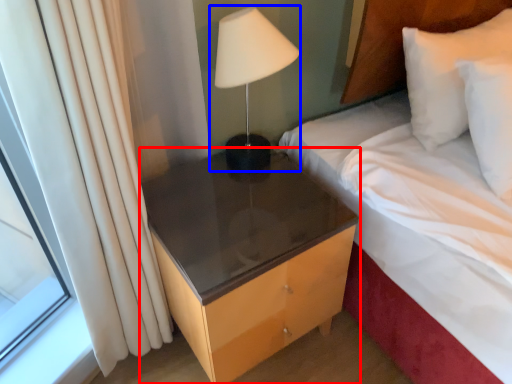
Question: Which of the following is the closest to the observer, nightstand (highlighted by a red box) or bedside lamp (highlighted by a blue box)?

Choices:
 (A) nightstand
 (B) bedside lamp

Answer: (B)